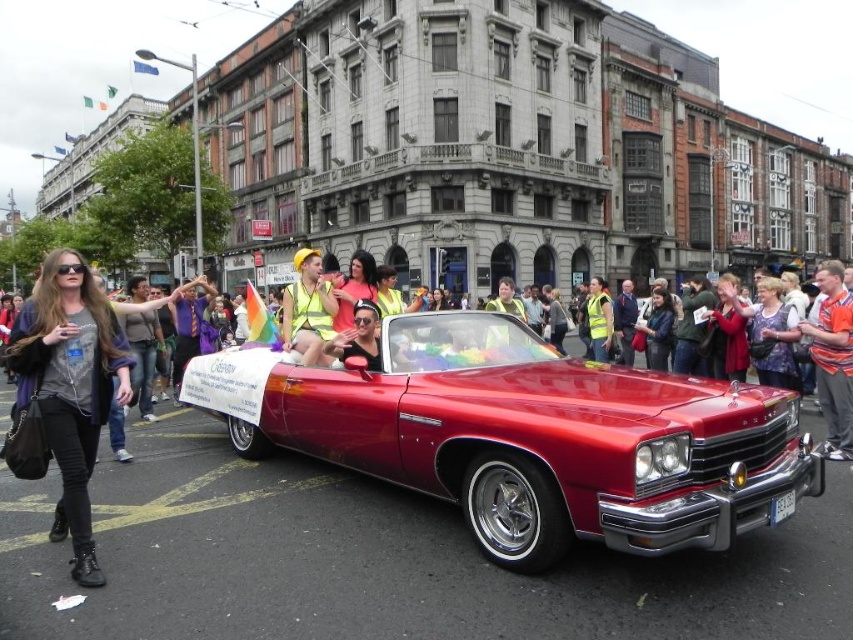
Question: Is shiny red car at center positioned behind orange shirt at center?

Choices:
 (A) yes
 (B) no

Answer: (B)

Question: Does shiny red car at center have a larger size compared to black leather jacket at left?

Choices:
 (A) no
 (B) yes

Answer: (B)

Question: Can you confirm if shiny red car at center is positioned above orange shirt at center?

Choices:
 (A) no
 (B) yes

Answer: (A)

Question: Which of these objects is positioned farthest from the black leather jacket at left?

Choices:
 (A) reflective yellow vest at center
 (B) shiny red car at center

Answer: (B)

Question: Which point appears farthest from the camera in this image?

Choices:
 (A) (102, 397)
 (B) (842, 413)
 (C) (583, 394)

Answer: (B)

Question: Which is farther from the reflective yellow vest at center?

Choices:
 (A) orange shirt at center
 (B) shiny red car at center
 (C) black leather jacket at left

Answer: (A)